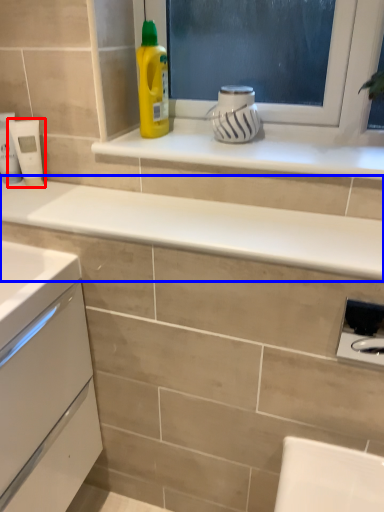
Question: Which of the following is the farthest to the observer, appliance (highlighted by a red box) or countertop (highlighted by a blue box)?

Choices:
 (A) appliance
 (B) countertop

Answer: (A)